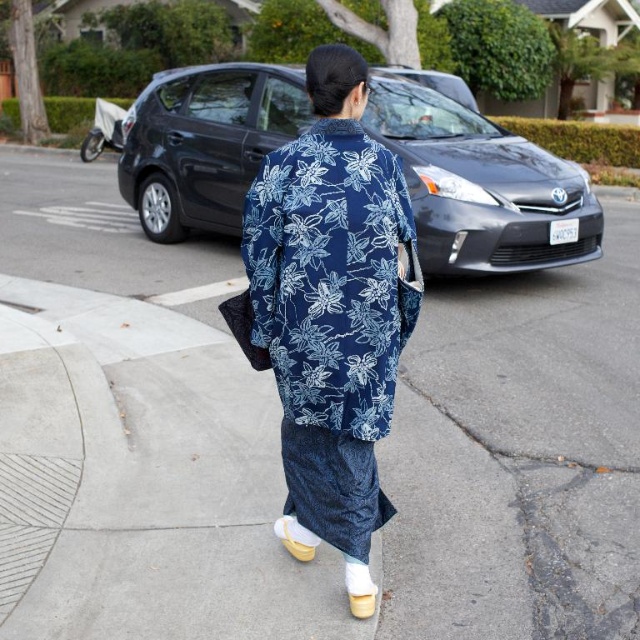
Does blue fabric kimono at center lie behind white suede sandal at lower center?

No, blue fabric kimono at center is closer to the viewer.

Who is higher up, blue fabric kimono at center or white suede sandal at lower center?

blue fabric kimono at center is above.

Does point (628, 513) lie behind point (292, 541)?

Yes, point (628, 513) is behind point (292, 541).

The image size is (640, 640). I want to click on blue fabric kimono at center, so click(278, 445).

Describe the element at coordinates (278, 445) in the screenshot. Image resolution: width=640 pixels, height=640 pixels. I see `blue fabric kimono at center` at that location.

Does blue fabric kimono at center have a lesser height compared to blue floral kimono at center?

Indeed, blue fabric kimono at center has a lesser height compared to blue floral kimono at center.

Who is more distant from viewer, (477, 531) or (364, 196)?

The point (477, 531) is more distant.

Image resolution: width=640 pixels, height=640 pixels. Identify the location of blue fabric kimono at center. (278, 445).

Who is positioned more to the right, blue floral kimono at center or white suede sandal at lower center?

blue floral kimono at center is more to the right.

Based on the photo, measure the distance between blue floral kimono at center and camera.

They are 2.49 meters apart.

Who is more forward, (273, 232) or (280, 538)?

Positioned in front is point (273, 232).

Identify the location of blue floral kimono at center. (332, 307).